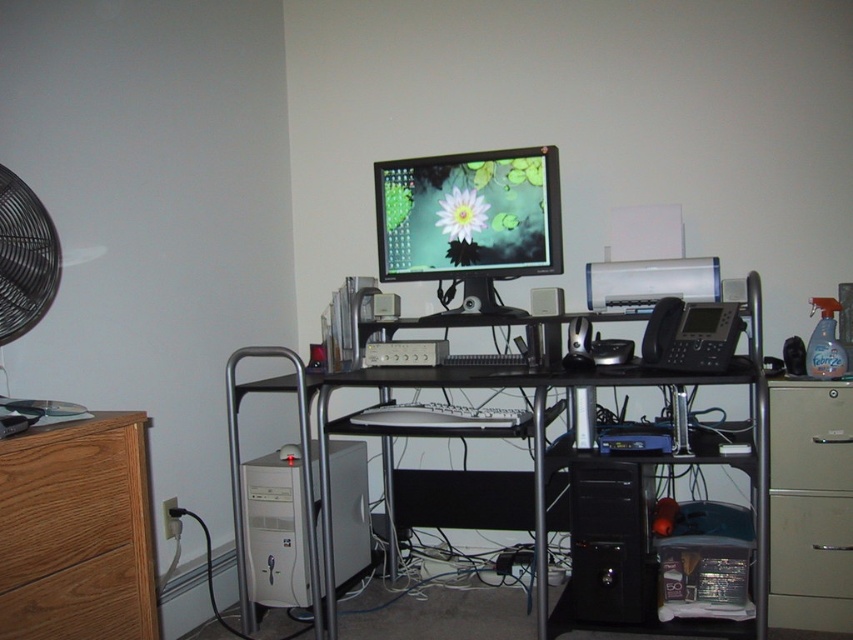
Between matte black monitor at center and beige/file cabinet at lower right, which one appears on the right side from the viewer's perspective?

Positioned to the right is beige/file cabinet at lower right.

Does matte black monitor at center appear on the right side of beige/file cabinet at lower right?

In fact, matte black monitor at center is to the left of beige/file cabinet at lower right.

Is point (378, 209) positioned behind point (827, 470)?

Yes, point (378, 209) is behind point (827, 470).

Find the location of `matte black monitor at center`. matte black monitor at center is located at coordinates (469, 220).

Is beige matte drawer at lower right shorter than metallic gray drawer at lower right?

Incorrect, beige matte drawer at lower right's height does not fall short of metallic gray drawer at lower right's.

Can you confirm if beige matte drawer at lower right is bigger than metallic gray drawer at lower right?

Yes.

Which is behind, point (799, 412) or point (849, 586)?

Point (849, 586)

The image size is (853, 640). I want to click on beige matte drawer at lower right, so click(810, 435).

What do you see at coordinates (77, 602) in the screenshot?
I see `wooden drawer at lower left` at bounding box center [77, 602].

Does point (117, 548) come behind point (788, 582)?

That is False.

What do you see at coordinates (77, 602) in the screenshot?
I see `wooden drawer at lower left` at bounding box center [77, 602].

Where is `wooden drawer at lower left`? wooden drawer at lower left is located at coordinates (77, 602).